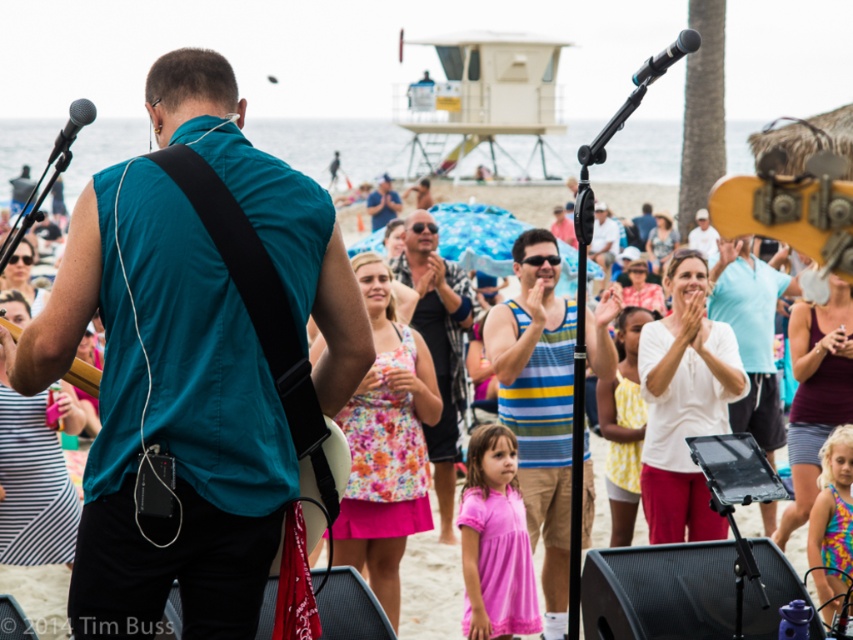
How distant is striped cotton tank top at center from floral fabric shirt at center?

striped cotton tank top at center is 6.87 meters from floral fabric shirt at center.

Is striped cotton tank top at center to the left of floral fabric shirt at center from the viewer's perspective?

No, striped cotton tank top at center is not to the left of floral fabric shirt at center.

This screenshot has width=853, height=640. What are the coordinates of `striped cotton tank top at center` in the screenshot? It's located at (544, 396).

Does black metallic microphone at upper center have a larger size compared to matte black microphone at upper left?

Incorrect, black metallic microphone at upper center is not larger than matte black microphone at upper left.

Between point (650, 72) and point (86, 116), which one is positioned in front?

Point (650, 72) is more forward.

Locate an element on the screen. black metallic microphone at upper center is located at coordinates click(666, 56).

Between wooden acoustic guitar at upper right and floral fabric dress at center, which one appears on the left side from the viewer's perspective?

From the viewer's perspective, floral fabric dress at center appears more on the left side.

Who is lower down, wooden acoustic guitar at upper right or floral fabric dress at center?

wooden acoustic guitar at upper right is lower down.

Is point (788, 230) positioned in front of point (598, 512)?

Yes, it is.

This screenshot has height=640, width=853. Find the location of `wooden acoustic guitar at upper right`. wooden acoustic guitar at upper right is located at coordinates (793, 211).